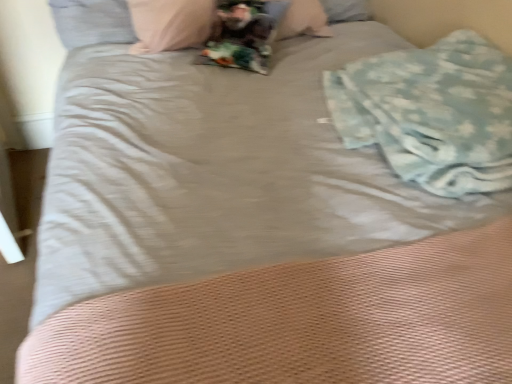
Question: Is light blue textured blanket at right inside or outside of gray fabric pillow at upper left?

Choices:
 (A) outside
 (B) inside

Answer: (A)

Question: In the image, is light blue textured blanket at right on the left side or the right side of gray fabric pillow at upper left?

Choices:
 (A) left
 (B) right

Answer: (B)

Question: Is light blue textured blanket at right taller or shorter than gray fabric pillow at upper left?

Choices:
 (A) tall
 (B) short

Answer: (B)

Question: Does point (86, 9) appear closer or farther from the camera than point (424, 89)?

Choices:
 (A) closer
 (B) farther

Answer: (B)

Question: In terms of height, does gray fabric pillow at upper left look taller or shorter compared to light blue textured blanket at right?

Choices:
 (A) short
 (B) tall

Answer: (B)

Question: From a real-world perspective, is gray fabric pillow at upper left physically located above or below light blue textured blanket at right?

Choices:
 (A) above
 (B) below

Answer: (B)

Question: Is gray fabric pillow at upper left inside the boundaries of light blue textured blanket at right, or outside?

Choices:
 (A) inside
 (B) outside

Answer: (B)